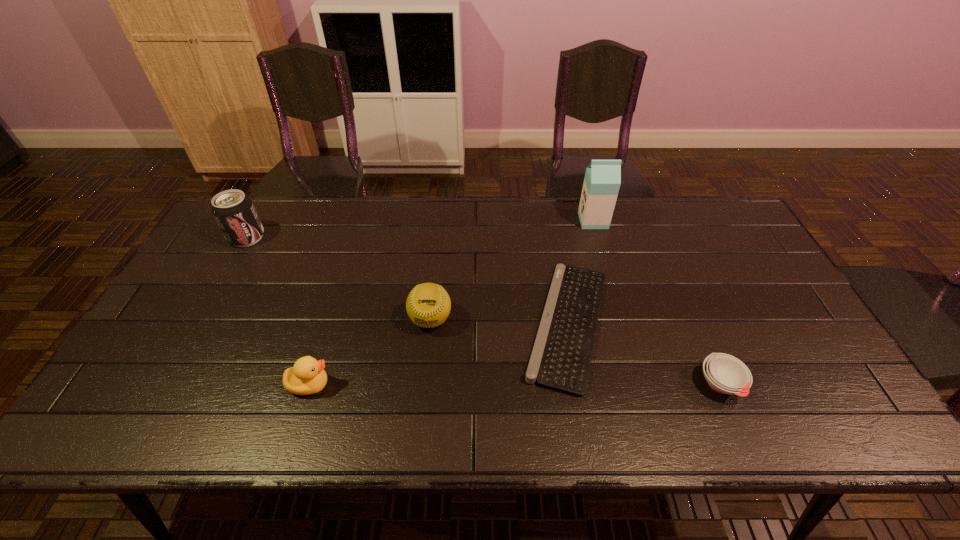
Where is `the tallest object`? The width and height of the screenshot is (960, 540). the tallest object is located at coordinates (602, 181).

You are a GUI agent. You are given a task and a screenshot of the screen. Output one action in this format:
    pyautogui.click(x=<x>, y=<y>)
    Task: Click on the soda can
    
    Given the screenshot: What is the action you would take?
    pyautogui.click(x=234, y=212)

You are a GUI agent. You are given a task and a screenshot of the screen. Output one action in this format:
    pyautogui.click(x=<x>, y=<y>)
    Task: Click on the leftmost object
    The image size is (960, 540).
    Given the screenshot: What is the action you would take?
    pyautogui.click(x=234, y=212)

Locate an element on the screen. The image size is (960, 540). softball is located at coordinates (428, 305).

At what (x,y) coordinates should I click in order to perform the action: click on the third tallest object. Please return your answer as a coordinate pair (x, y). Looking at the image, I should click on (428, 305).

Locate an element on the screen. The width and height of the screenshot is (960, 540). the fourth tallest object is located at coordinates (307, 376).

Where is `duck`? The height and width of the screenshot is (540, 960). duck is located at coordinates (307, 376).

The image size is (960, 540). Identify the location of the fifth tallest object. (725, 374).

Image resolution: width=960 pixels, height=540 pixels. What are the coordinates of `the rightmost object` in the screenshot? It's located at (725, 374).

At what (x,y) coordinates should I click in order to perform the action: click on the shortest object. Please return your answer as a coordinate pair (x, y). Image resolution: width=960 pixels, height=540 pixels. Looking at the image, I should click on (561, 357).